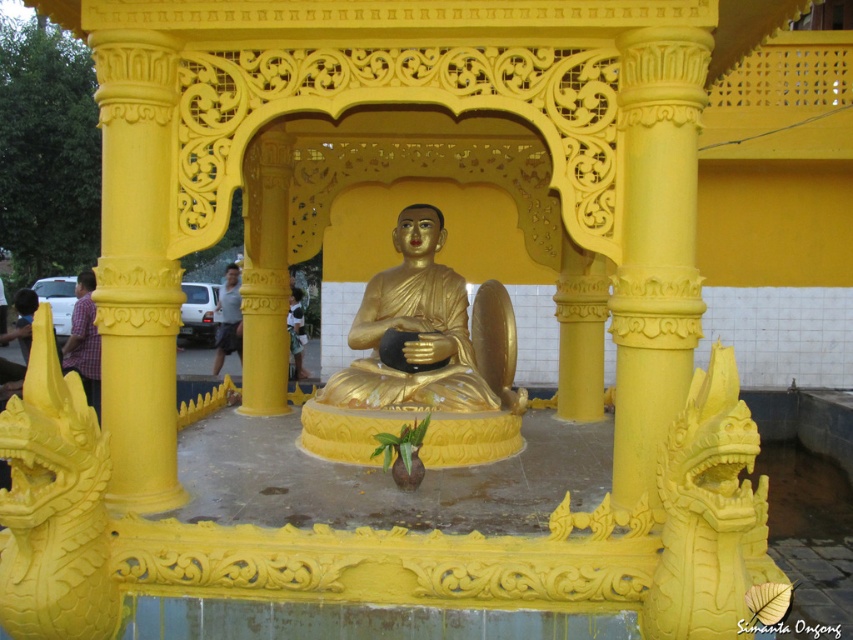
You are a visitor standing at the entrance of the pavilion and want to take a photo of the gold polished statue at center. However, there is a matte yellow column at center blocking your view. Can you move to the side to avoid the column and still see the statue?

The matte yellow column at center is in front of the gold polished statue at center, so moving to the side would allow you to see around the column and still view the statue.

You are standing at the entrance of the pavilion and want to place a new offering directly in front of the gold polished statue at center. According to the coordinates provided, where should you place the offering relative to the statue?

The gold polished statue at center is located at coordinates point (413, 330), so you should place the offering directly in front of it at the same x and y coordinates but slightly forward along the z axis.

You are an interior designer planning to place a 1.2 meter wide decorative screen between the matte yellow column at center and the plaid shirt at left. Based on their widths, will the screen fit between them?

The matte yellow column at center is wider than the plaid shirt at left. Therefore, the 1.2 meter wide decorative screen may not fit between them if the space between the two objects is narrower than the screen.